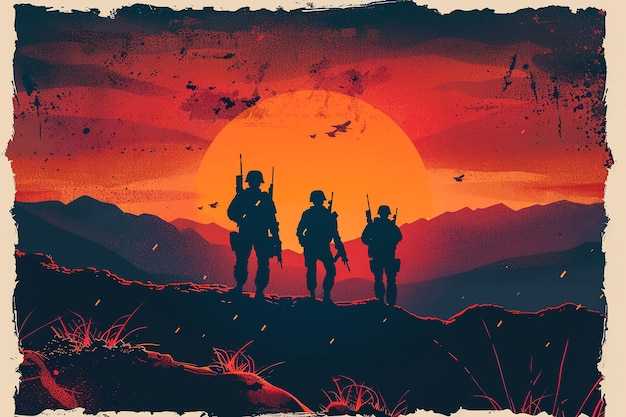
Where is `art work`? art work is located at coordinates (576, 68).